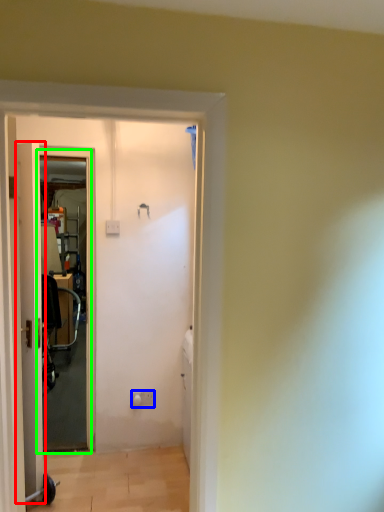
Question: Which object is the farthest from door (highlighted by a red box)? Choose among these: electric outlet (highlighted by a blue box) or screen door (highlighted by a green box).

Choices:
 (A) electric outlet
 (B) screen door

Answer: (A)